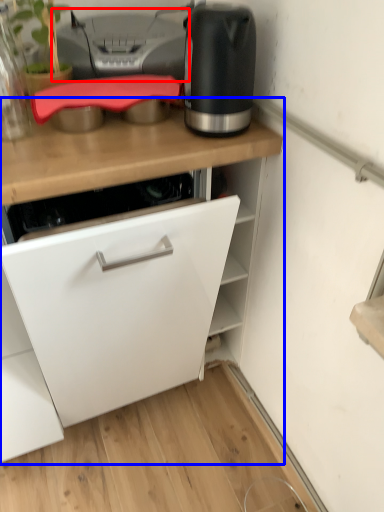
Question: Which object is further to the camera taking this photo, printer (highlighted by a red box) or cabinetry (highlighted by a blue box)?

Choices:
 (A) printer
 (B) cabinetry

Answer: (A)